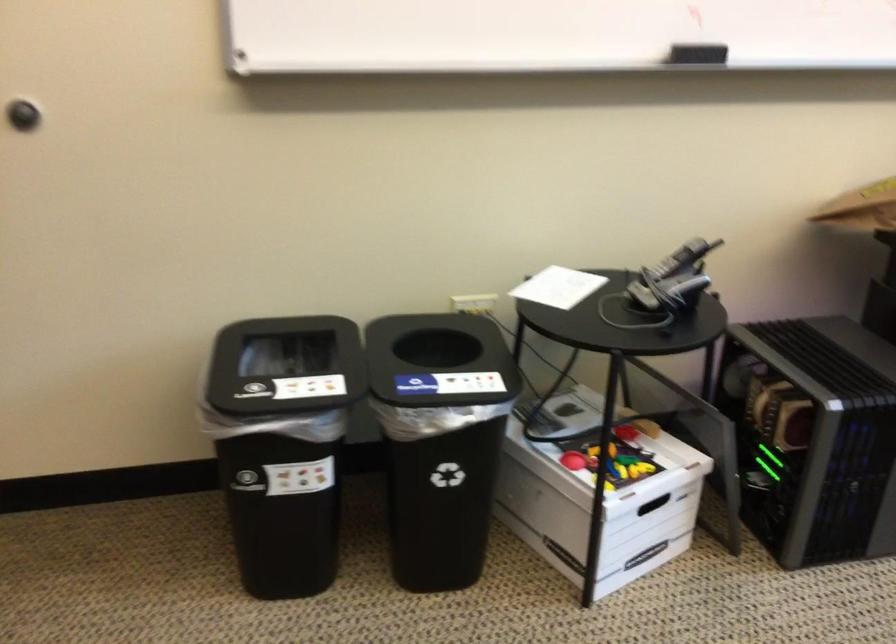
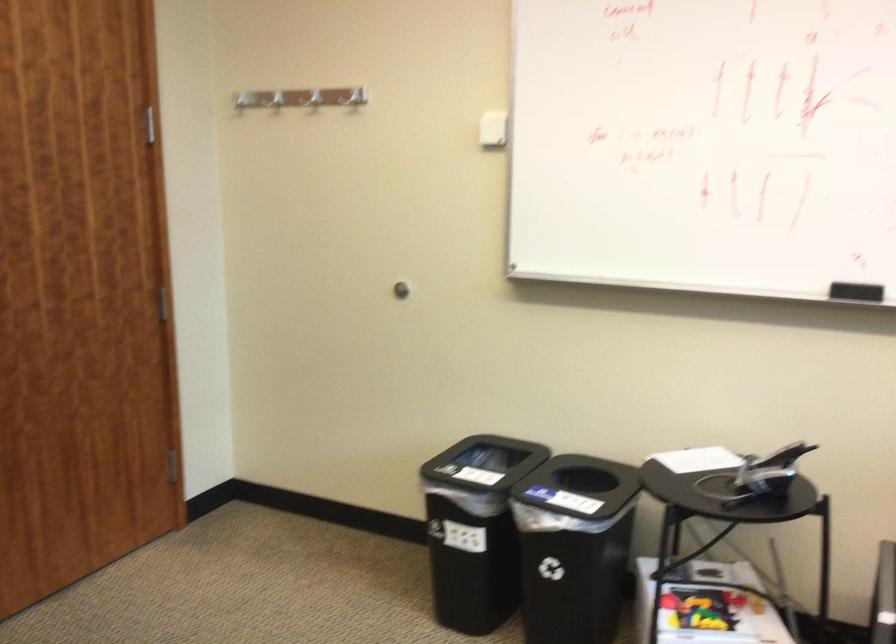
In the second image, find the point that corresponds to (x=480, y=439) in the first image.

(574, 547)